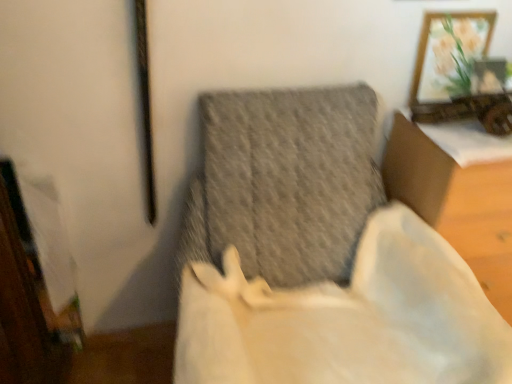
Question: Is white fabric cushion at center, the first furniture from the right, looking in the opposite direction of textured gray cushion at center, the second furniture viewed from the right?

Choices:
 (A) no
 (B) yes

Answer: (A)

Question: Is white fabric cushion at center, acting as the second furniture starting from the left, smaller than textured gray cushion at center, the second furniture viewed from the right?

Choices:
 (A) yes
 (B) no

Answer: (A)

Question: Does white fabric cushion at center, acting as the second furniture starting from the left, have a greater width compared to textured gray cushion at center, the first furniture from the left?

Choices:
 (A) no
 (B) yes

Answer: (A)

Question: Is white fabric cushion at center, acting as the second furniture starting from the left, shorter than textured gray cushion at center, the second furniture viewed from the right?

Choices:
 (A) yes
 (B) no

Answer: (A)

Question: Is white fabric cushion at center, the first furniture from the right, outside textured gray cushion at center, the first furniture from the left?

Choices:
 (A) no
 (B) yes

Answer: (B)

Question: Considering the relative positions of white fabric cushion at center, acting as the second furniture starting from the left, and textured gray cushion at center, the second furniture viewed from the right, in the image provided, is white fabric cushion at center, acting as the second furniture starting from the left, to the left of textured gray cushion at center, the second furniture viewed from the right, from the viewer's perspective?

Choices:
 (A) no
 (B) yes

Answer: (A)

Question: From a real-world perspective, is wooden framed artwork at upper right under textured gray cushion at center, the first furniture from the left?

Choices:
 (A) yes
 (B) no

Answer: (B)

Question: Is wooden framed artwork at upper right positioned far away from textured gray cushion at center, the second furniture viewed from the right?

Choices:
 (A) no
 (B) yes

Answer: (A)

Question: Does wooden framed artwork at upper right have a lesser height compared to textured gray cushion at center, the first furniture from the left?

Choices:
 (A) yes
 (B) no

Answer: (A)

Question: Does wooden framed artwork at upper right turn towards textured gray cushion at center, the first furniture from the left?

Choices:
 (A) yes
 (B) no

Answer: (B)

Question: From the image's perspective, does wooden framed artwork at upper right appear lower than textured gray cushion at center, the first furniture from the left?

Choices:
 (A) yes
 (B) no

Answer: (B)

Question: Considering the relative sizes of wooden framed artwork at upper right and textured gray cushion at center, the second furniture viewed from the right, in the image provided, is wooden framed artwork at upper right bigger than textured gray cushion at center, the second furniture viewed from the right,?

Choices:
 (A) no
 (B) yes

Answer: (A)

Question: Considering the relative sizes of white fabric cushion at center, the first furniture from the right, and wooden framed artwork at upper right in the image provided, is white fabric cushion at center, the first furniture from the right, smaller than wooden framed artwork at upper right?

Choices:
 (A) no
 (B) yes

Answer: (A)